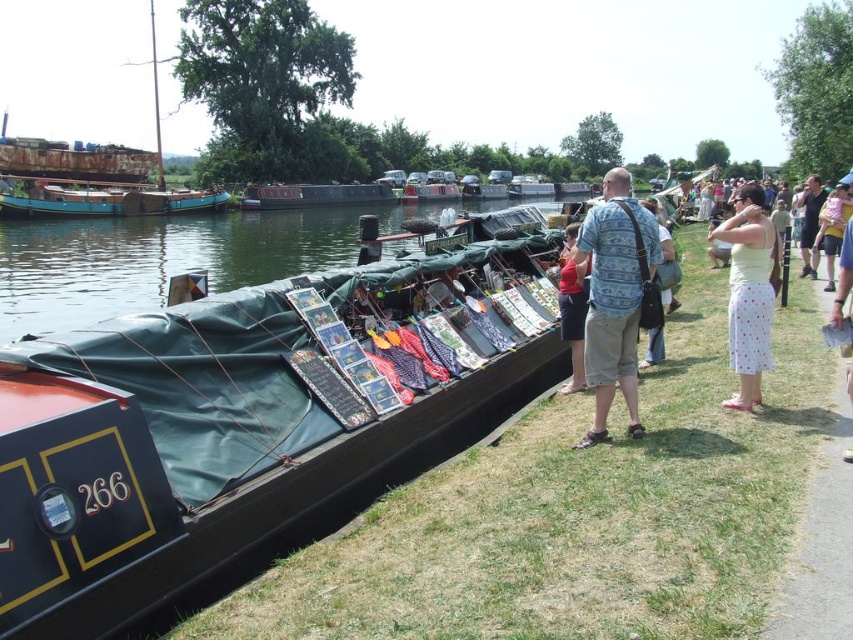
Does rusty metal boat at left have a larger size compared to light pink fabric at upper right?

Correct, rusty metal boat at left is larger in size than light pink fabric at upper right.

Which of these two, rusty metal boat at left or light pink fabric at upper right, stands shorter?

light pink fabric at upper right is shorter.

Where is `rusty metal boat at left`? rusty metal boat at left is located at coordinates (103, 198).

Is point (827, 269) less distant than point (677, 305)?

No, (827, 269) is further to viewer.

Which of these two, light pink fabric at upper right or blue fabric bag at center, stands shorter?

light pink fabric at upper right is shorter.

Between point (827, 198) and point (637, 364), which one is positioned behind?

The point (827, 198) is behind.

Where is `light pink fabric at upper right`? Image resolution: width=853 pixels, height=640 pixels. light pink fabric at upper right is located at coordinates (833, 225).

Is rusty metal boat at upper left to the left of metallic silver boat at center from the viewer's perspective?

Correct, you'll find rusty metal boat at upper left to the left of metallic silver boat at center.

Can you confirm if rusty metal boat at upper left is taller than metallic silver boat at center?

Yes.

Identify the location of rusty metal boat at upper left. This screenshot has height=640, width=853. (94, 173).